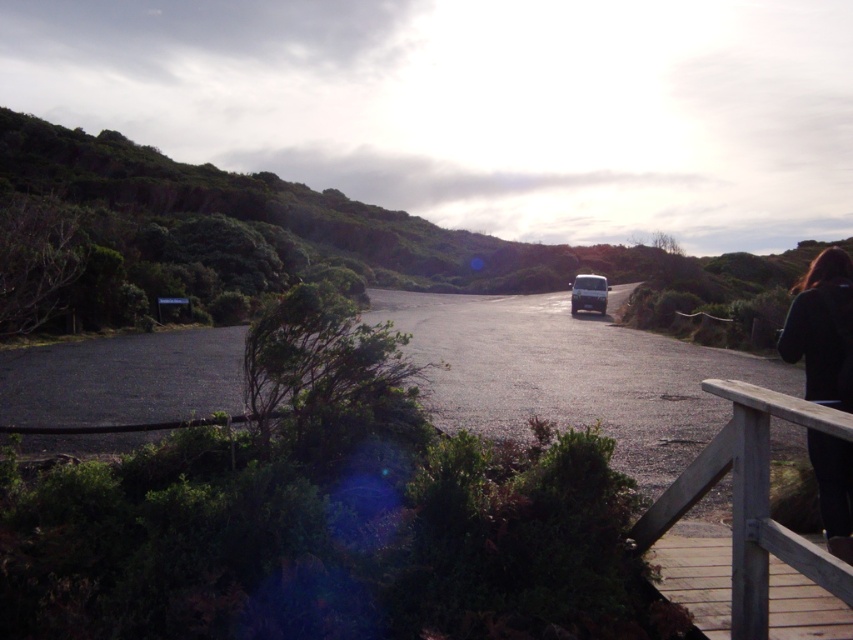
Is wooden at right below black fabric at lower right?

Indeed, wooden at right is positioned under black fabric at lower right.

Between wooden at right and black fabric at lower right, which one appears on the left side from the viewer's perspective?

From the viewer's perspective, wooden at right appears more on the left side.

Is point (741, 445) positioned behind point (784, 330)?

That is False.

The image size is (853, 640). I want to click on wooden at right, so click(751, 500).

Between wooden at right and white matte suv at center, which one is positioned higher?

white matte suv at center

Is point (805, 547) more distant than point (573, 312)?

That is False.

You are a GUI agent. You are given a task and a screenshot of the screen. Output one action in this format:
    pyautogui.click(x=<x>, y=<y>)
    Task: Click on the wooden at right
    
    Given the screenshot: What is the action you would take?
    pyautogui.click(x=751, y=500)

Can you confirm if black fabric at lower right is smaller than white matte suv at center?

Yes, black fabric at lower right is smaller than white matte suv at center.

Is point (846, 369) closer to camera compared to point (602, 310)?

Yes, it is.

Which is behind, point (821, 314) or point (587, 305)?

The point (587, 305) is behind.

Where is `black fabric at lower right`? The height and width of the screenshot is (640, 853). black fabric at lower right is located at coordinates (822, 330).